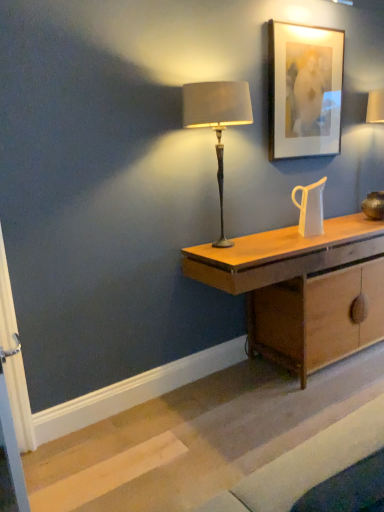
You are a GUI agent. You are given a task and a screenshot of the screen. Output one action in this format:
    pyautogui.click(x=<x>, y=<y>)
    Task: Click on the vacant area that lies to the right of matte beige fabric lampshade at center
    This screenshot has width=384, height=512.
    Given the screenshot: What is the action you would take?
    pyautogui.click(x=280, y=243)